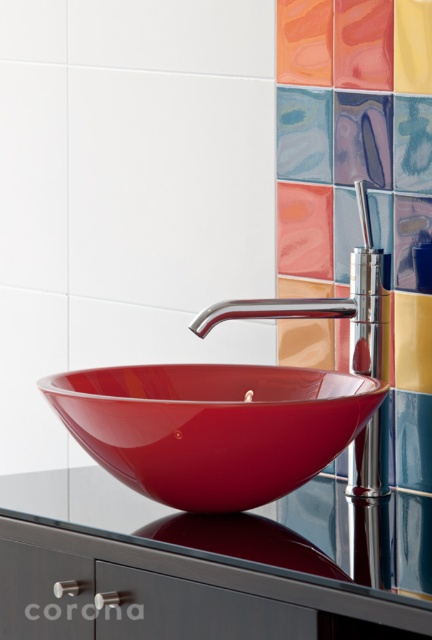
At what (x,y) coordinates should I click in order to perform the action: click on glossy glass counter at center. Please return your answer as a coordinate pair (x, y). The width and height of the screenshot is (432, 640). Looking at the image, I should click on (209, 566).

Between glossy glass counter at center and glossy glass bowl at center, which one is positioned higher?

glossy glass bowl at center is higher up.

Find the location of a particular element. glossy glass counter at center is located at coordinates (209, 566).

Consider the image. Can you confirm if chrome metallic faucet at center is positioned below matte pink tile at center?

Correct, chrome metallic faucet at center is located below matte pink tile at center.

Is point (378, 257) closer to viewer compared to point (298, 156)?

Yes, it is.

What do you see at coordinates (334, 304) in the screenshot? The height and width of the screenshot is (640, 432). I see `chrome metallic faucet at center` at bounding box center [334, 304].

You are a GUI agent. You are given a task and a screenshot of the screen. Output one action in this format:
    pyautogui.click(x=<x>, y=<y>)
    Task: Click on the chrome metallic faucet at center
    
    Given the screenshot: What is the action you would take?
    pyautogui.click(x=334, y=304)

Can you confirm if glossy glass bowl at center is positioned below chrome metallic faucet at center?

Yes.

Is glossy glass bowl at center bigger than chrome metallic faucet at center?

Indeed, glossy glass bowl at center has a larger size compared to chrome metallic faucet at center.

What do you see at coordinates (212, 428) in the screenshot?
I see `glossy glass bowl at center` at bounding box center [212, 428].

Locate an element on the screen. glossy glass bowl at center is located at coordinates (212, 428).